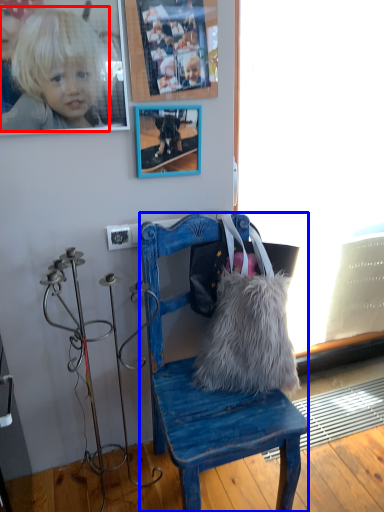
Question: Which object appears farthest to the camera in this image, person (highlighted by a red box) or chair (highlighted by a blue box)?

Choices:
 (A) person
 (B) chair

Answer: (A)